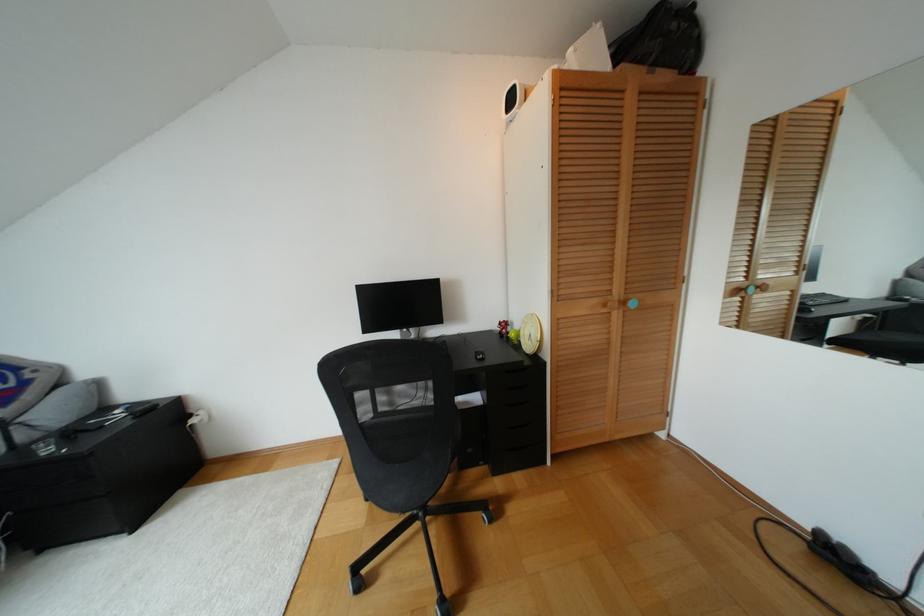
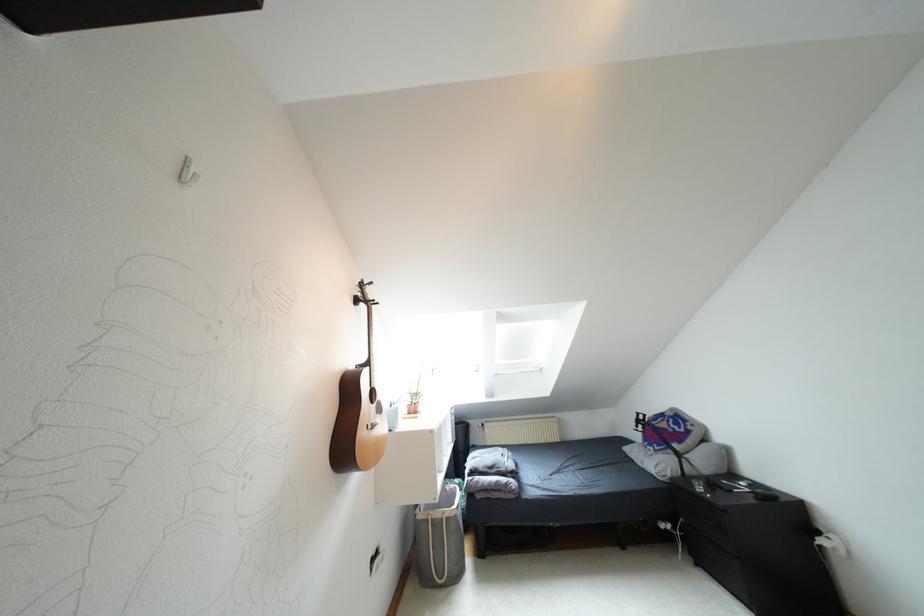
Question: The first image is from the beginning of the video and the second image is from the end. How did the camera likely rotate when shooting the video?

Choices:
 (A) Left
 (B) Right
 (C) Up
 (D) Down

Answer: (A)